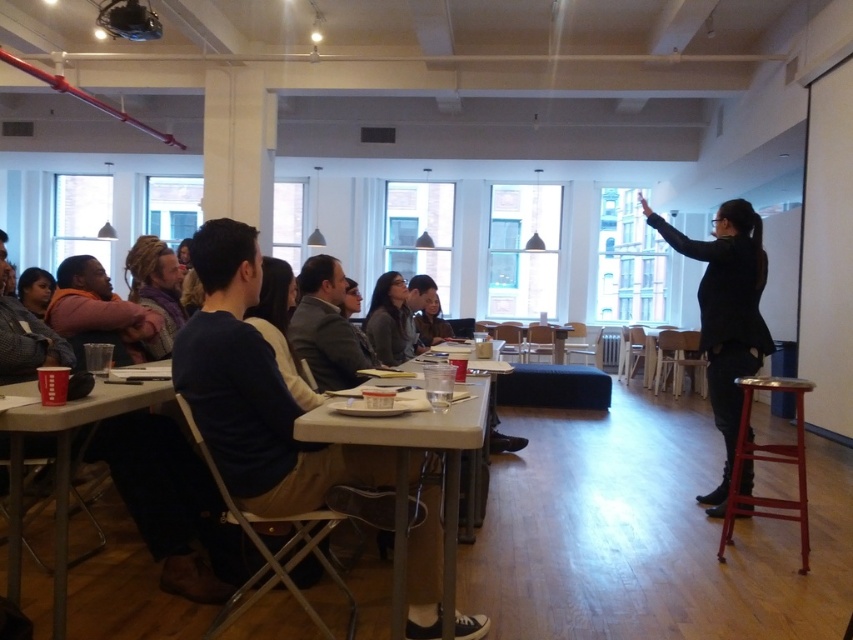
You are sitting at the smooth plastic table at center and want to hand a document to someone behind the matte purple scarf at center. Can you reach them without moving from your seat?

The matte purple scarf at center is further to the viewer than the smooth plastic table at center, meaning it is closer to you. Since the scarf is closer, you can likely reach the person behind it without moving from your seat.

You are a participant in the classroom and want to reach for the matte plastic cup at lower left during the discussion. Can you easily access it without moving the smooth plastic table at center?

The matte plastic cup at lower left is positioned under the smooth plastic table at center, so it might be difficult to access without moving the table.

You are standing in the classroom and need to reach both the point at coordinates (53, 584) and the point at coordinates (384, 300). Which point is closer to you?

The point at coordinates (53, 584) is closer to you than the point at coordinates (384, 300).